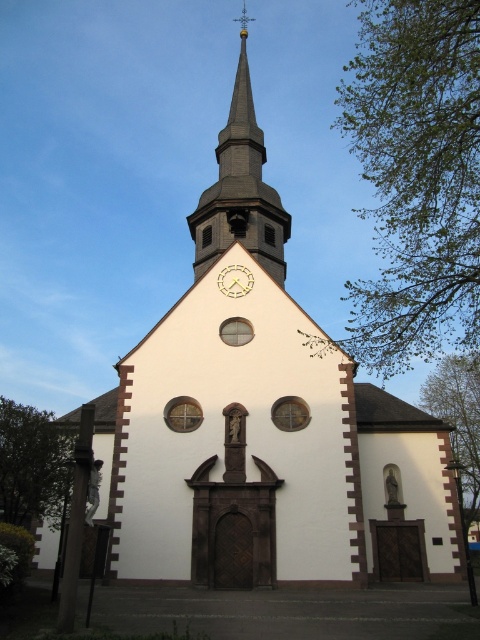
Between smooth gray steeple at upper center and gold metallic clock at center, which one has more height?

Standing taller between the two is smooth gray steeple at upper center.

Who is more forward, (x=276, y=250) or (x=235, y=272)?

Positioned in front is point (x=235, y=272).

Is point (255, 144) less distant than point (242, 280)?

No, it is behind (242, 280).

The width and height of the screenshot is (480, 640). I want to click on smooth gray steeple at upper center, so pyautogui.click(x=240, y=188).